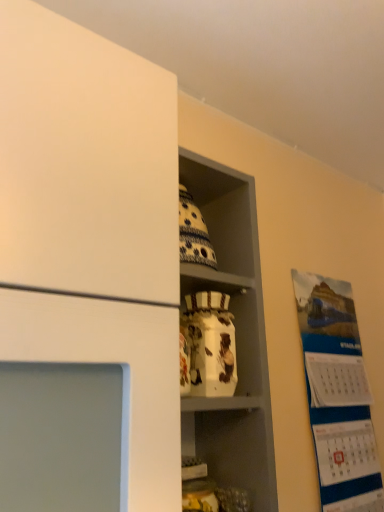
Question: Is white paper calendar at right taller than white glossy vase at center?

Choices:
 (A) no
 (B) yes

Answer: (B)

Question: Does white paper calendar at right have a lesser height compared to white glossy vase at center?

Choices:
 (A) no
 (B) yes

Answer: (A)

Question: Is white paper calendar at right placed right next to white glossy vase at center?

Choices:
 (A) no
 (B) yes

Answer: (A)

Question: Is white paper calendar at right wider than white glossy vase at center?

Choices:
 (A) yes
 (B) no

Answer: (B)

Question: From a real-world perspective, is white paper calendar at right located beneath white glossy vase at center?

Choices:
 (A) no
 (B) yes

Answer: (B)

Question: Is white paper calendar at right facing towards white glossy vase at center?

Choices:
 (A) yes
 (B) no

Answer: (B)

Question: From a real-world perspective, is white glossy jar at center beneath white glossy vase at center?

Choices:
 (A) no
 (B) yes

Answer: (B)

Question: Considering the relative positions of white glossy jar at center and white glossy vase at center in the image provided, is white glossy jar at center to the left of white glossy vase at center from the viewer's perspective?

Choices:
 (A) no
 (B) yes

Answer: (A)

Question: Is white glossy jar at center positioned before white glossy vase at center?

Choices:
 (A) no
 (B) yes

Answer: (A)

Question: From the image's perspective, would you say white glossy jar at center is shown under white glossy vase at center?

Choices:
 (A) no
 (B) yes

Answer: (B)

Question: Is white glossy jar at center turned away from white glossy vase at center?

Choices:
 (A) yes
 (B) no

Answer: (A)

Question: From a real-world perspective, is white glossy jar at center located higher than white glossy vase at center?

Choices:
 (A) yes
 (B) no

Answer: (B)

Question: Considering the relative sizes of white glossy vase at center and white glossy jar at center in the image provided, is white glossy vase at center smaller than white glossy jar at center?

Choices:
 (A) no
 (B) yes

Answer: (A)